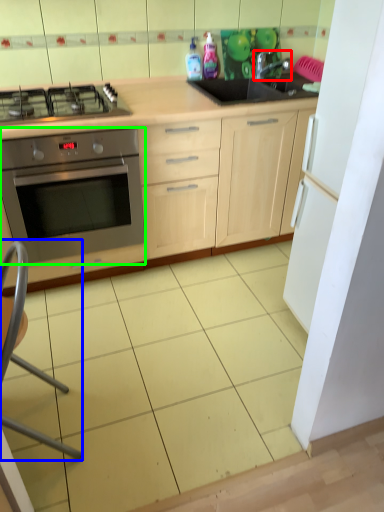
Question: Which object is the farthest from tap (highlighted by a red box)? Choose among these: folding chair (highlighted by a blue box) or oven (highlighted by a green box).

Choices:
 (A) folding chair
 (B) oven

Answer: (A)